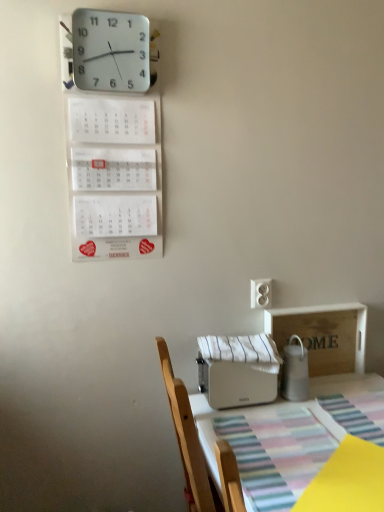
Question: Which direction should I rotate to look at white plastic toaster at lower center, positioned as the first appliance in left-to-right order?

Choices:
 (A) right
 (B) left

Answer: (A)

Question: Does white paper calendar at upper left have a greater height compared to white plastic wall clock at upper left?

Choices:
 (A) no
 (B) yes

Answer: (B)

Question: Does white paper calendar at upper left have a greater width compared to white plastic wall clock at upper left?

Choices:
 (A) no
 (B) yes

Answer: (A)

Question: Is white paper calendar at upper left in contact with white plastic wall clock at upper left?

Choices:
 (A) no
 (B) yes

Answer: (A)

Question: Considering the relative positions of white paper calendar at upper left and white plastic wall clock at upper left in the image provided, is white paper calendar at upper left behind white plastic wall clock at upper left?

Choices:
 (A) no
 (B) yes

Answer: (B)

Question: Is white paper calendar at upper left positioned far away from white plastic wall clock at upper left?

Choices:
 (A) yes
 (B) no

Answer: (B)

Question: Is white paper calendar at upper left positioned in front of white plastic wall clock at upper left?

Choices:
 (A) yes
 (B) no

Answer: (B)

Question: Would you consider white glossy milk jug at right, placed as the 2th appliance when sorted from left to right, to be distant from white paper calendar at upper left?

Choices:
 (A) yes
 (B) no

Answer: (B)

Question: Is white glossy milk jug at right, placed as the 2th appliance when sorted from left to right, facing towards white paper calendar at upper left?

Choices:
 (A) no
 (B) yes

Answer: (A)

Question: Can we say white glossy milk jug at right, placed as the 2th appliance when sorted from left to right, lies outside white paper calendar at upper left?

Choices:
 (A) yes
 (B) no

Answer: (A)

Question: Considering the relative positions of white glossy milk jug at right, placed as the 2th appliance when sorted from left to right, and white paper calendar at upper left in the image provided, is white glossy milk jug at right, placed as the 2th appliance when sorted from left to right, in front of white paper calendar at upper left?

Choices:
 (A) no
 (B) yes

Answer: (A)

Question: Is white glossy milk jug at right, placed as the 2th appliance when sorted from left to right, wider than white paper calendar at upper left?

Choices:
 (A) no
 (B) yes

Answer: (B)

Question: From the image's perspective, is white glossy milk jug at right, acting as the 1th appliance starting from the right, located above white paper calendar at upper left?

Choices:
 (A) no
 (B) yes

Answer: (A)

Question: Is white striped fabric at center in front of white plastic electric outlet at center-right?

Choices:
 (A) yes
 (B) no

Answer: (A)